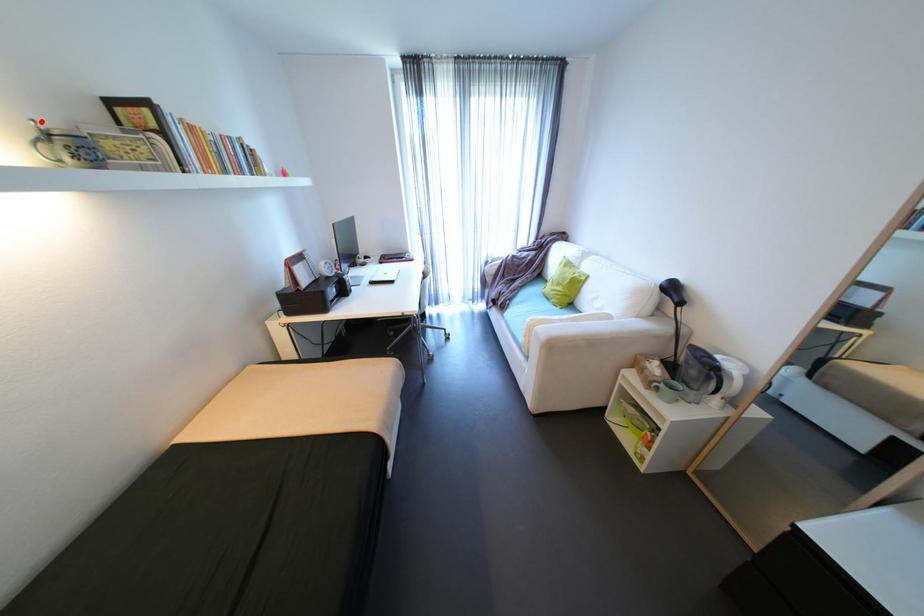
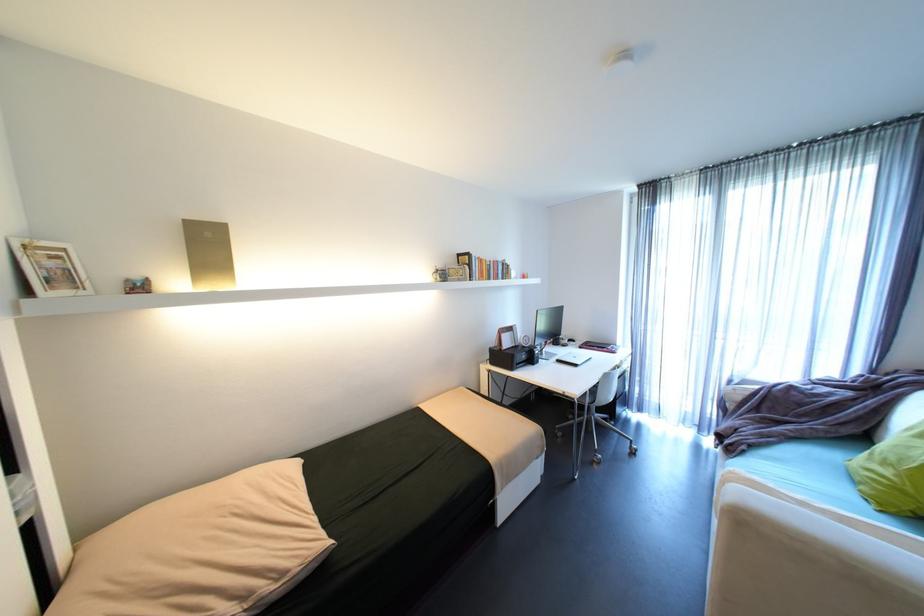
The point at the highlighted location is marked in the first image. Where is the corresponding point in the second image?

(444, 267)